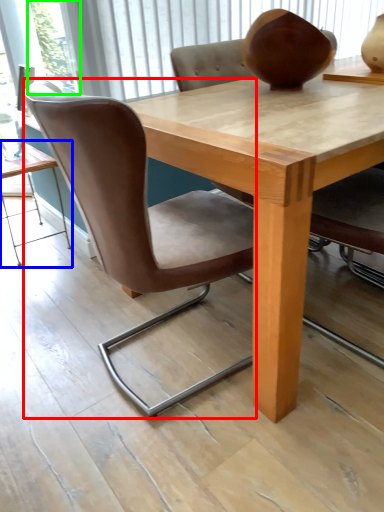
Question: Estimate the real-world distances between objects in this image. Which object is closer to chair (highlighted by a red box), table (highlighted by a blue box) or glass door (highlighted by a green box)?

Choices:
 (A) table
 (B) glass door

Answer: (A)